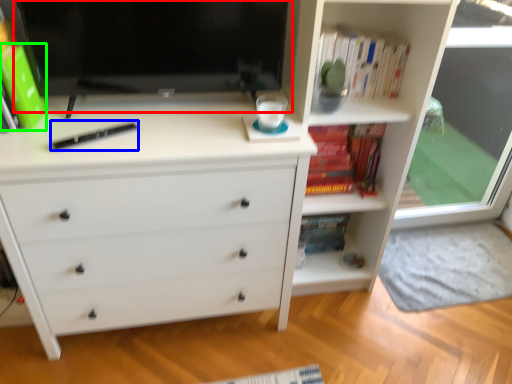
Question: Which is farther away from computer monitor (highlighted by a red box)? hardback book (highlighted by a blue box) or paperback book (highlighted by a green box)?

Choices:
 (A) hardback book
 (B) paperback book

Answer: (B)